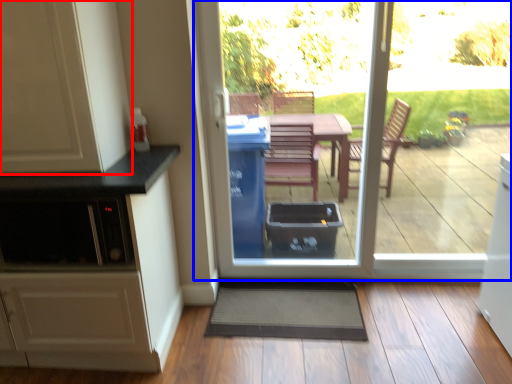
Question: Which point is further to the camera, cabinetry (highlighted by a red box) or door (highlighted by a blue box)?

Choices:
 (A) cabinetry
 (B) door

Answer: (B)